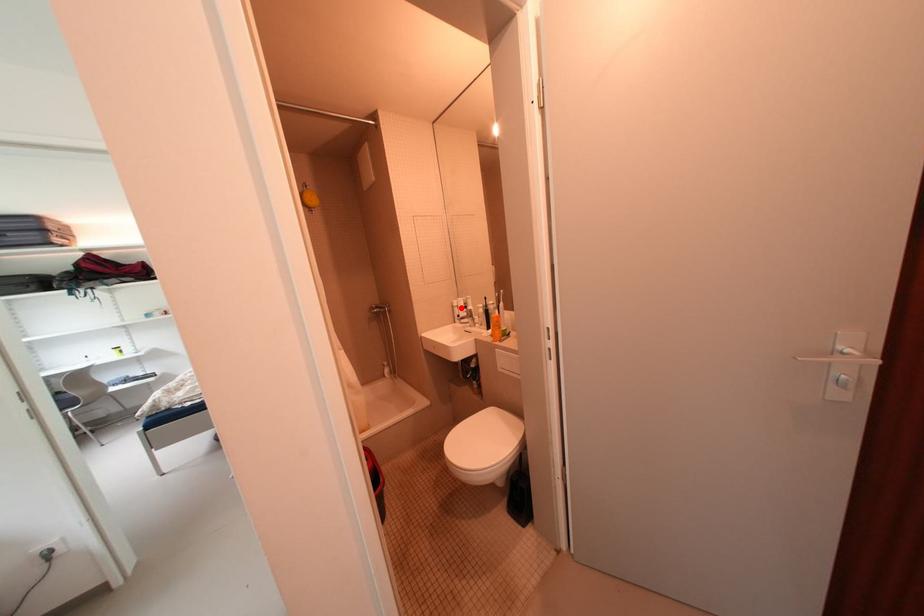
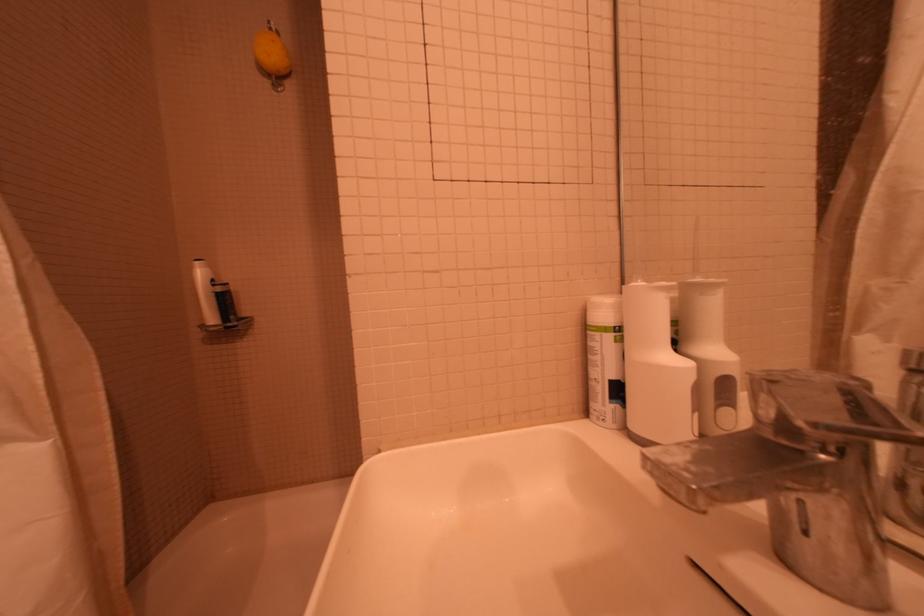
Find the pixel in the second image that matches the highlighted location in the first image.

(593, 330)